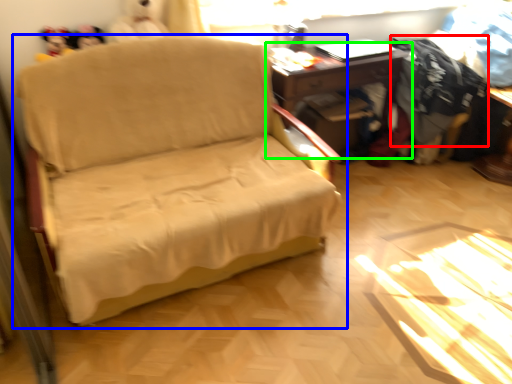
Question: Considering the real-world distances, which object is farthest from clothing (highlighted by a red box)? studio couch (highlighted by a blue box) or table (highlighted by a green box)?

Choices:
 (A) studio couch
 (B) table

Answer: (A)